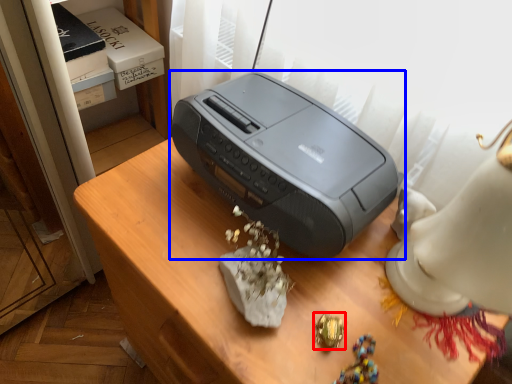
Question: Which object is further to the camera taking this photo, jewellery (highlighted by a red box) or printer (highlighted by a blue box)?

Choices:
 (A) jewellery
 (B) printer

Answer: (A)